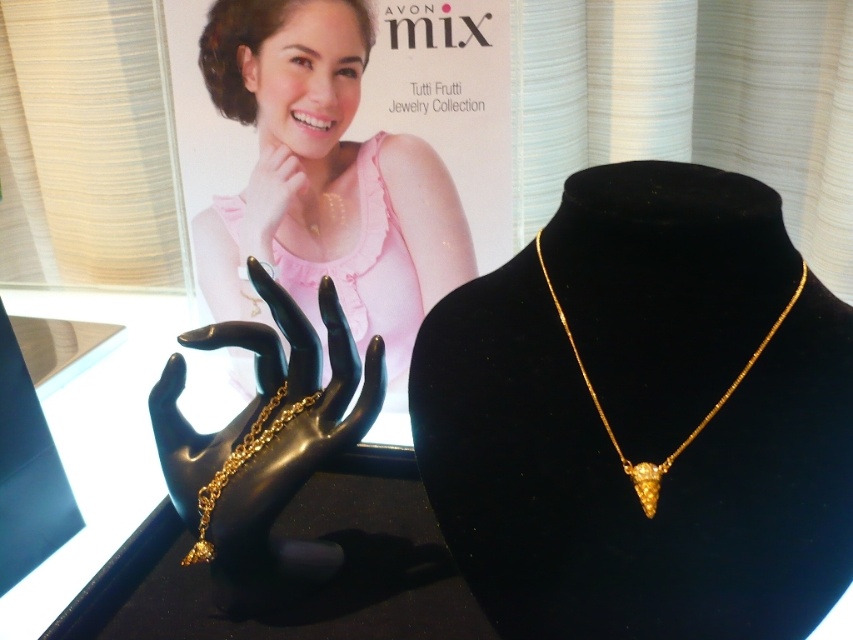
Question: Does gold metallic bracelet at center come behind gold shiny necklace at center?

Choices:
 (A) yes
 (B) no

Answer: (A)

Question: Is matte gold necklace at center above gold metallic ring at upper center?

Choices:
 (A) yes
 (B) no

Answer: (B)

Question: Does gold shiny necklace at center appear over gold chain at center?

Choices:
 (A) no
 (B) yes

Answer: (B)

Question: Among these objects, which one is farthest from the camera?

Choices:
 (A) gold metallic ring at upper center
 (B) gold shiny necklace at center
 (C) gold chain at center
 (D) gold metallic bracelet at center

Answer: (A)

Question: Which of the following is the closest to the observer?

Choices:
 (A) (265, 218)
 (B) (338, 339)
 (C) (431, 278)
 (D) (643, 467)

Answer: (D)

Question: Among these objects, which one is farthest from the camera?

Choices:
 (A) gold chain at center
 (B) matte gold necklace at center
 (C) gold shiny necklace at center
 (D) gold metallic bracelet at center

Answer: (B)